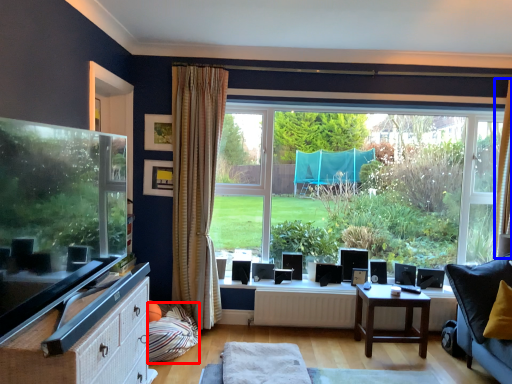
Question: Which point is further to the camera, pillow (highlighted by a red box) or curtain (highlighted by a blue box)?

Choices:
 (A) pillow
 (B) curtain

Answer: (B)